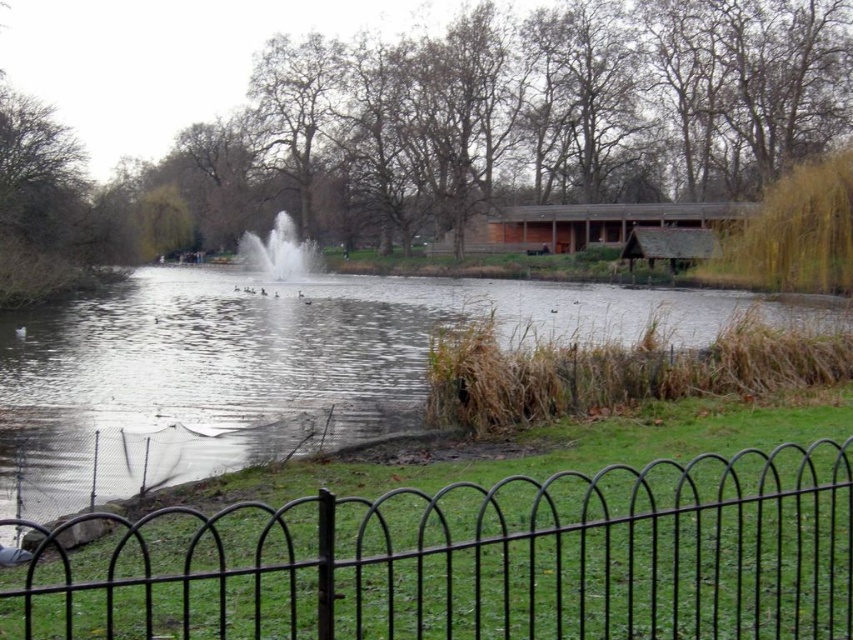
You are a park visitor who wants to take a photo of the fountain. The clear water at center and white frothy water at center are both part of the fountain. Which part of the fountain should you focus on if you want to capture the highest point of the water spray?

The white frothy water at center is taller than the clear water at center, so focusing on the white frothy water at center will capture the highest point of the fountain spray.

You are standing at the edge of the park and want to get a closer look at the ducks swimming in the pond. The black metal fence at lower center is blocking your view. Can you estimate if you can step over the fence to see the ducks better?

The black metal fence at lower center is 3.39 meters away from the viewer. Since the distance is too far to step over, you cannot get closer to the ducks by stepping over the fence.

In the scene shown: You are a photographer trying to capture the white frothy water at center without the black metal fence at lower center appearing in the shot. Is this possible based on their heights?

The black metal fence at lower center is shorter than the white frothy water at center, so if you position yourself lower or use a wide angle to frame the shot, you can likely capture the white frothy water at center without the fence obstructing the view.